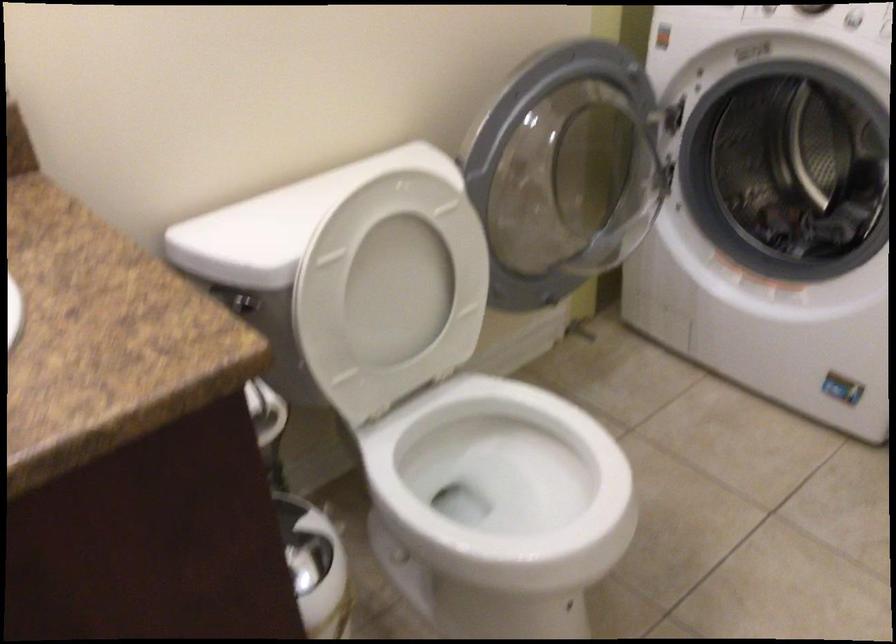
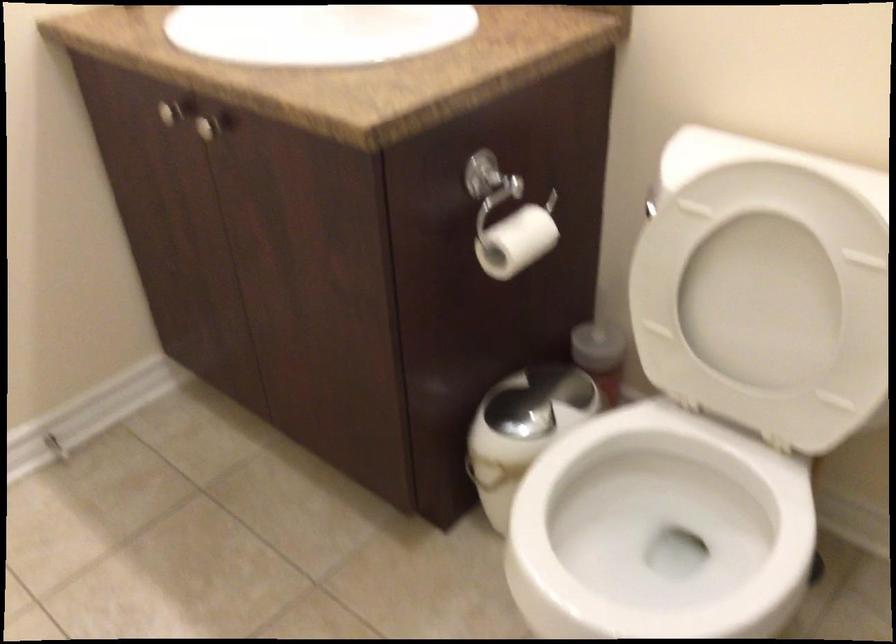
The point at (440, 507) is marked in the first image. Where is the corresponding point in the second image?

(660, 524)